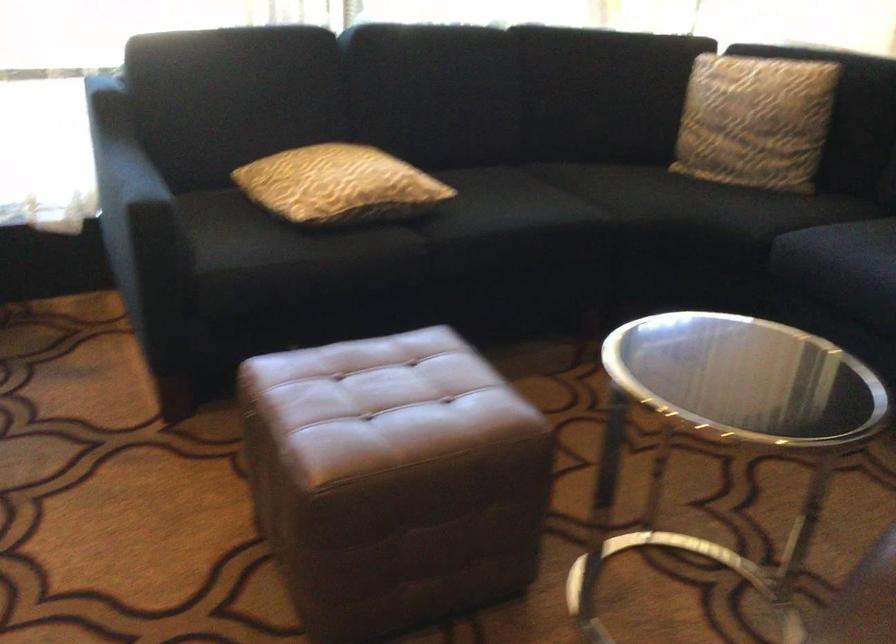
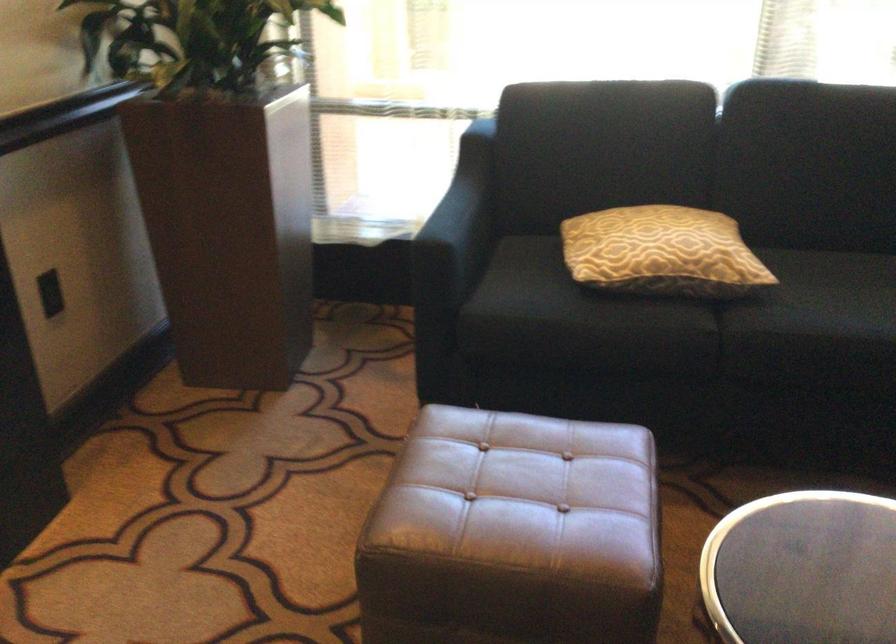
Find the pixel in the second image that matches the point at 409,401 in the first image.

(522, 495)